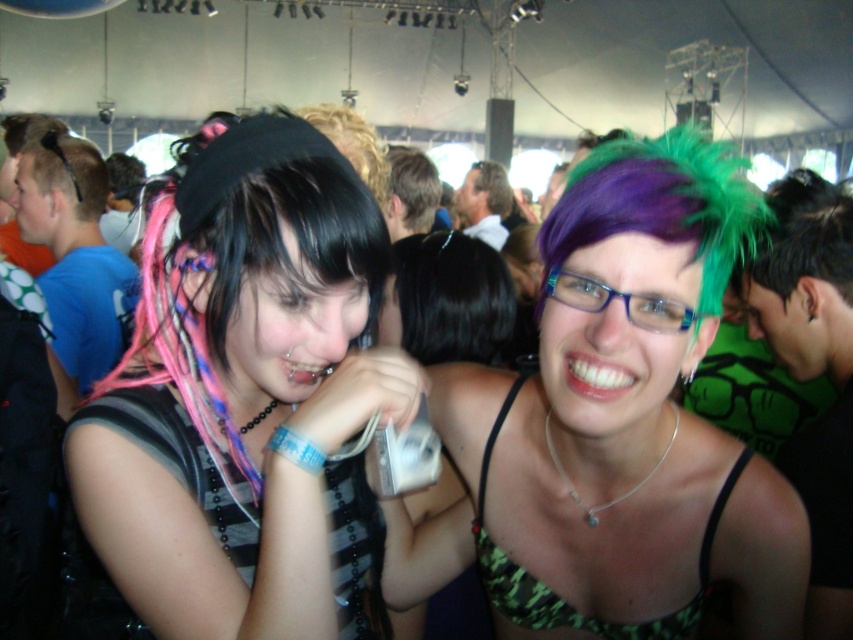
Question: Is matte black hair at center thinner than green camouflage bikini top at center?

Choices:
 (A) yes
 (B) no

Answer: (B)

Question: Can you confirm if matte black hair at center is bigger than green camouflage bikini top at center?

Choices:
 (A) no
 (B) yes

Answer: (B)

Question: Among these objects, which one is farthest from the camera?

Choices:
 (A) matte black hair at center
 (B) multicolored hair at center

Answer: (B)

Question: Which object is farther from the camera taking this photo?

Choices:
 (A) green camouflage bikini top at center
 (B) matte black hair at center
 (C) multicolored hair at center

Answer: (A)

Question: Does matte black hair at center have a smaller size compared to multicolored hair at center?

Choices:
 (A) yes
 (B) no

Answer: (A)

Question: Which point is closer to the camera taking this photo?

Choices:
 (A) (550, 627)
 (B) (666, 289)
 (C) (316, 465)

Answer: (B)